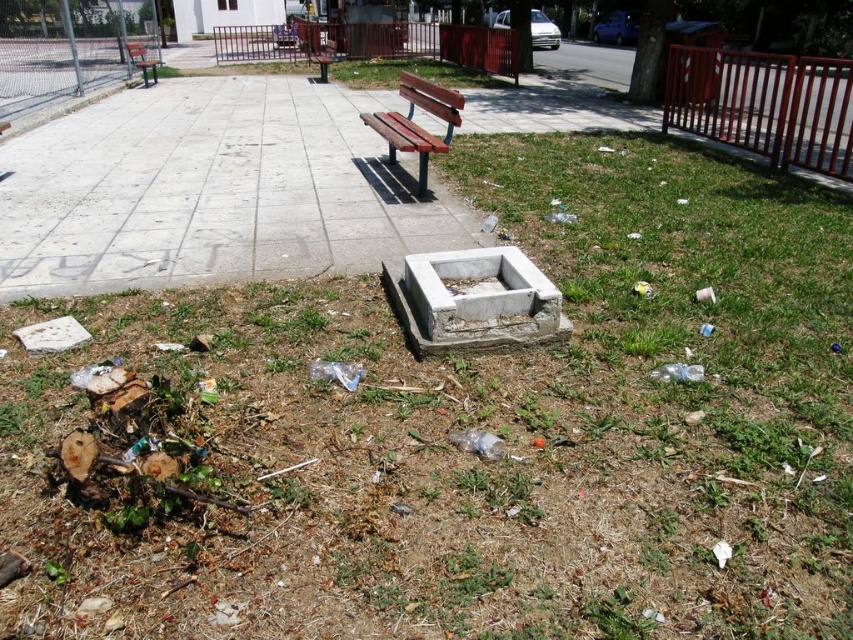
Who is more forward, (x=253, y=273) or (x=137, y=48)?

Point (x=253, y=273) is in front.

Is concrete pavement at center to the left of wooden bench at upper left from the viewer's perspective?

Incorrect, concrete pavement at center is not on the left side of wooden bench at upper left.

Identify the location of concrete pavement at center. (212, 189).

Is wooden bench at center above wooden bench at upper left?

Actually, wooden bench at center is below wooden bench at upper left.

Where is `wooden bench at center`? wooden bench at center is located at coordinates (415, 124).

Between concrete pavement at center and wooden bench at center, which one is positioned higher?

concrete pavement at center

Is concrete pavement at center to the right of wooden bench at center from the viewer's perspective?

No, concrete pavement at center is not to the right of wooden bench at center.

Is point (189, 96) positioned behind point (436, 145)?

Yes.

Identify the location of concrete pavement at center. This screenshot has height=640, width=853. (x=212, y=189).